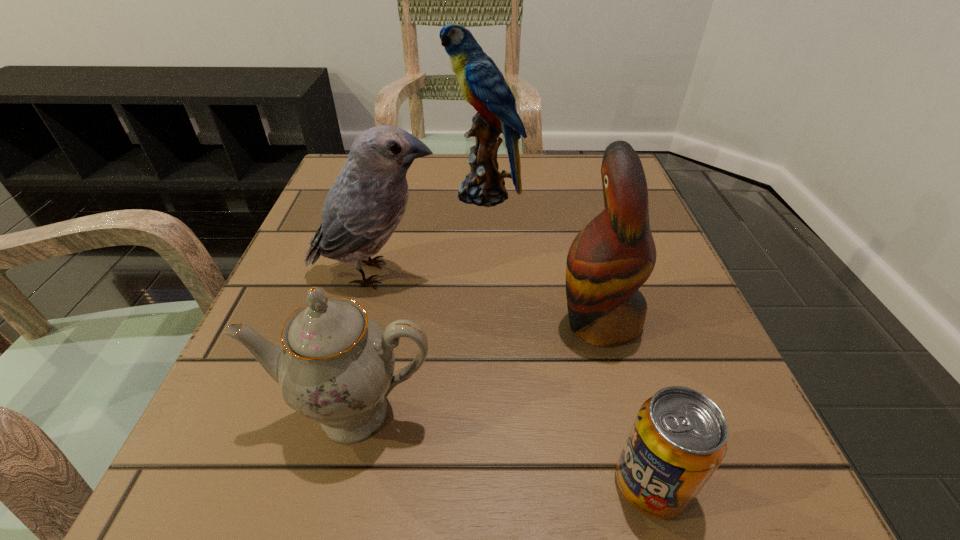
Find the location of a particular element. The width and height of the screenshot is (960, 540). free space located on the face of the rightmost parrot is located at coordinates (343, 321).

Where is `free location located on the face of the rightmost parrot`? This screenshot has height=540, width=960. free location located on the face of the rightmost parrot is located at coordinates (405, 321).

This screenshot has height=540, width=960. In order to click on free space located 0.150m on the front-facing side of the second farthest object in this screenshot , I will do `click(526, 273)`.

Locate an element on the screen. The width and height of the screenshot is (960, 540). vacant space located on the spout of the chinaware is located at coordinates (332, 505).

Find the location of a particular element. vacant area located 0.170m on the left of the shortest object is located at coordinates (468, 483).

You are a GUI agent. You are given a task and a screenshot of the screen. Output one action in this format:
    pyautogui.click(x=<x>, y=<y>)
    Task: Click on the object that is positioned at the far edge
    The height and width of the screenshot is (540, 960).
    Given the screenshot: What is the action you would take?
    pyautogui.click(x=483, y=85)

This screenshot has height=540, width=960. In order to click on chinaware present at the near edge in this screenshot , I will do `click(336, 367)`.

Locate an element on the screen. This screenshot has width=960, height=540. soda can that is at the near edge is located at coordinates (679, 437).

This screenshot has width=960, height=540. Find the location of `parrot positioned at the left edge`. parrot positioned at the left edge is located at coordinates (364, 206).

The height and width of the screenshot is (540, 960). What are the coordinates of `chinaware at the left edge` in the screenshot? It's located at (336, 367).